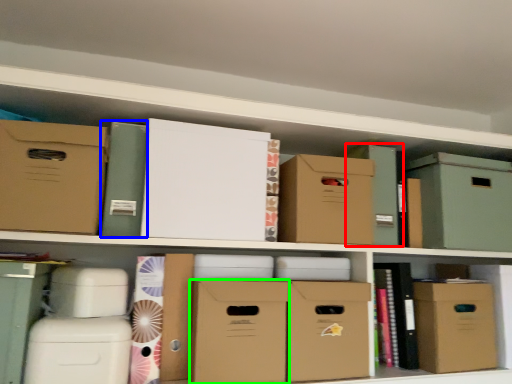
Question: Considering the real-world distances, which object is closest to box (highlighted by a red box)? book (highlighted by a blue box) or cardboard box (highlighted by a green box).

Choices:
 (A) book
 (B) cardboard box

Answer: (B)